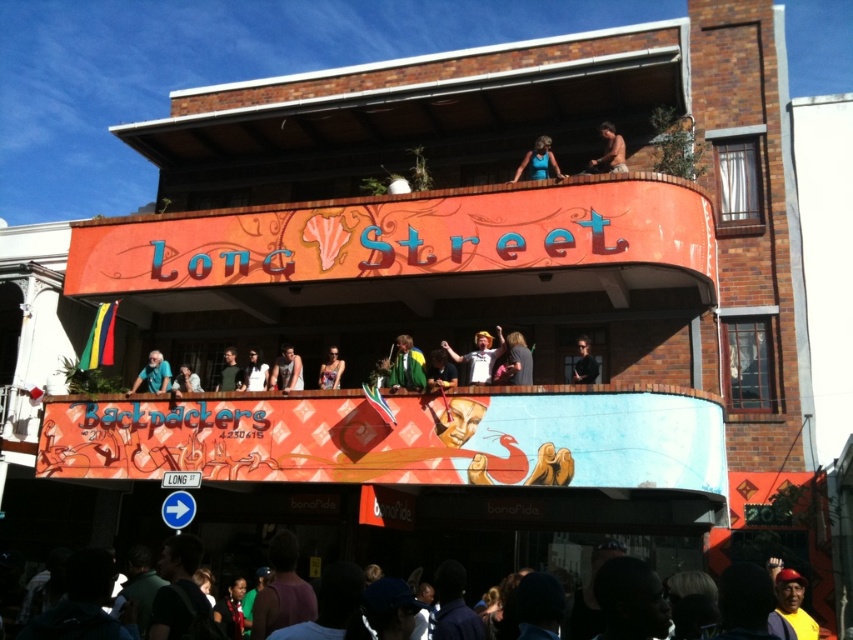
Does dark brown leather jacket at center have a lesser height compared to matte blue shirt at center?

In fact, dark brown leather jacket at center may be taller than matte blue shirt at center.

Does dark brown leather jacket at center have a larger size compared to matte blue shirt at center?

Yes.

Is point (521, 362) closer to camera compared to point (158, 371)?

Yes, it is.

Locate an element on the screen. This screenshot has height=640, width=853. dark brown leather jacket at center is located at coordinates (515, 362).

Can you confirm if white t-shirt at upper center is positioned to the left of light brown leather jacket at center?

Incorrect, white t-shirt at upper center is not on the left side of light brown leather jacket at center.

In the scene shown: Is white t-shirt at upper center to the right of light brown leather jacket at center from the viewer's perspective?

Correct, you'll find white t-shirt at upper center to the right of light brown leather jacket at center.

At what (x,y) coordinates should I click in order to perform the action: click on white t-shirt at upper center. Please return your answer as a coordinate pair (x, y). The width and height of the screenshot is (853, 640). Looking at the image, I should click on (479, 356).

You are a GUI agent. You are given a task and a screenshot of the screen. Output one action in this format:
    pyautogui.click(x=<x>, y=<y>)
    Task: Click on the white t-shirt at upper center
    
    Given the screenshot: What is the action you would take?
    pyautogui.click(x=479, y=356)

Who is positioned more to the right, dark brown leather jacket at center or bare skin at upper center?

Positioned to the right is bare skin at upper center.

Can you confirm if dark brown leather jacket at center is positioned to the right of bare skin at upper center?

In fact, dark brown leather jacket at center is to the left of bare skin at upper center.

Who is more distant from viewer, (527,374) or (614,150)?

Positioned behind is point (614,150).

Find the location of a particular element. This screenshot has width=853, height=640. dark brown leather jacket at center is located at coordinates pyautogui.click(x=515, y=362).